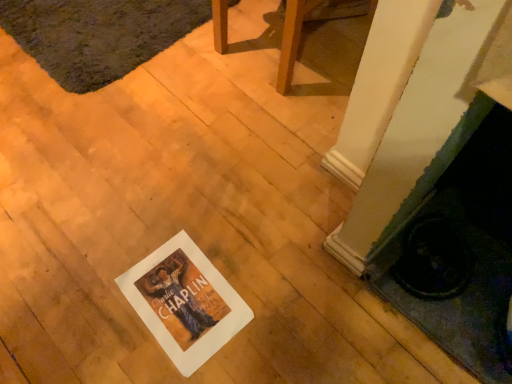
Describe the element at coordinates (311, 21) in the screenshot. I see `wooden chair at center` at that location.

This screenshot has height=384, width=512. What do you see at coordinates (184, 302) in the screenshot?
I see `white paper at center` at bounding box center [184, 302].

You are a GUI agent. You are given a task and a screenshot of the screen. Output one action in this format:
    pyautogui.click(x=<x>, y=<y>)
    Task: Click on the wooden chair at center
    This screenshot has width=512, height=384.
    Given the screenshot: What is the action you would take?
    pyautogui.click(x=311, y=21)

Is dark gray shaggy rug at upper left to the left of wooden chair at center from the viewer's perspective?

Correct, you'll find dark gray shaggy rug at upper left to the left of wooden chair at center.

Identify the location of furniture in front of the dark gray shaggy rug at upper left. This screenshot has width=512, height=384. (311, 21).

Who is taller, dark gray shaggy rug at upper left or wooden chair at center?

With more height is wooden chair at center.

Would you say white paper at center is to the left or to the right of wooden chair at center in the picture?

white paper at center is to the left of wooden chair at center.

How different are the orientations of white paper at center and wooden chair at center in degrees?

white paper at center and wooden chair at center are facing 8.36 degrees away from each other.

Can you confirm if white paper at center is smaller than wooden chair at center?

Yes, white paper at center is smaller than wooden chair at center.

Which is behind, white paper at center or wooden chair at center?

wooden chair at center is further from the camera.

Considering the relative sizes of wooden chair at center and white paper at center in the image provided, is wooden chair at center wider than white paper at center?

Indeed, wooden chair at center has a greater width compared to white paper at center.

Considering the relative sizes of wooden chair at center and white paper at center in the image provided, is wooden chair at center taller than white paper at center?

Yes, wooden chair at center is taller than white paper at center.

From the image's perspective, does wooden chair at center appear lower than white paper at center?

Incorrect, from the image's perspective, wooden chair at center is higher than white paper at center.

From a real-world perspective, which is physically below, wooden chair at center or white paper at center?

From a 3D spatial view, white paper at center is below.

Is dark gray shaggy rug at upper left oriented away from white paper at center?

No, dark gray shaggy rug at upper left's orientation is not away from white paper at center.

From the image's perspective, is dark gray shaggy rug at upper left on top of white paper at center?

Yes.

What's the angular difference between dark gray shaggy rug at upper left and white paper at center's facing directions?

They differ by 3.1 degrees in their facing directions.

Would you consider wooden chair at center to be distant from dark gray shaggy rug at upper left?

They are positioned close to each other.

Locate an element on the screen. mat that is on the left side of wooden chair at center is located at coordinates (98, 35).

Considering the positions of objects wooden chair at center and dark gray shaggy rug at upper left in the image provided, who is more to the left, wooden chair at center or dark gray shaggy rug at upper left?

dark gray shaggy rug at upper left is more to the left.

Could you tell me if wooden chair at center is turned towards dark gray shaggy rug at upper left?

No, wooden chair at center is not facing towards dark gray shaggy rug at upper left.

Considering the points (139, 315) and (42, 49), which point is behind, point (139, 315) or point (42, 49)?

Point (42, 49)

Is white paper at center positioned far away from dark gray shaggy rug at upper left?

No, white paper at center is in close proximity to dark gray shaggy rug at upper left.

Can you confirm if white paper at center is thinner than dark gray shaggy rug at upper left?

Yes.

Looking at this image, from the image's perspective, does white paper at center appear higher than dark gray shaggy rug at upper left?

Incorrect, from the image's perspective, white paper at center is lower than dark gray shaggy rug at upper left.

The height and width of the screenshot is (384, 512). In order to click on furniture lying in front of the dark gray shaggy rug at upper left in this screenshot , I will do `click(311, 21)`.

Locate an element on the screen. The width and height of the screenshot is (512, 384). furniture behind the white paper at center is located at coordinates tap(311, 21).

Estimate the real-world distances between objects in this image. Which object is closer to white paper at center, wooden chair at center or dark gray shaggy rug at upper left?

wooden chair at center is positioned closer to the anchor white paper at center.

Consider the image. Which object lies nearer to the anchor point white paper at center, dark gray shaggy rug at upper left or wooden chair at center?

Based on the image, wooden chair at center appears to be nearer to white paper at center.

Estimate the real-world distances between objects in this image. Which object is further from dark gray shaggy rug at upper left, wooden chair at center or white paper at center?

white paper at center lies further to dark gray shaggy rug at upper left than the other object.

Looking at the image, which one is located closer to wooden chair at center, dark gray shaggy rug at upper left or white paper at center?

dark gray shaggy rug at upper left is closer to wooden chair at center.

Which object lies nearer to the anchor point wooden chair at center, white paper at center or dark gray shaggy rug at upper left?

dark gray shaggy rug at upper left lies closer to wooden chair at center than the other object.

When comparing their distances from dark gray shaggy rug at upper left, does white paper at center or wooden chair at center seem further?

Among the two, white paper at center is located further to dark gray shaggy rug at upper left.

Locate an element on the screen. The width and height of the screenshot is (512, 384). furniture between dark gray shaggy rug at upper left and white paper at center in the up-down direction is located at coordinates (311, 21).